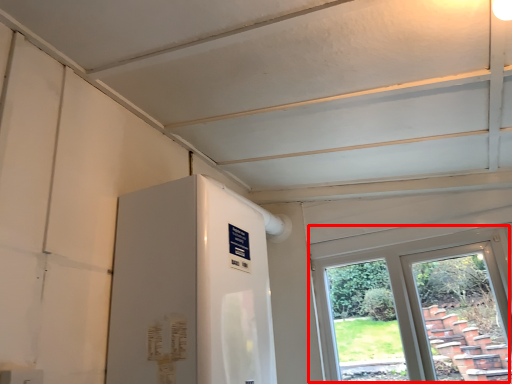
Question: From the image's perspective, considering the relative positions of window (annotated by the red box) and water heater in the image provided, where is window (annotated by the red box) located with respect to the staircase?

Choices:
 (A) below
 (B) above

Answer: (A)